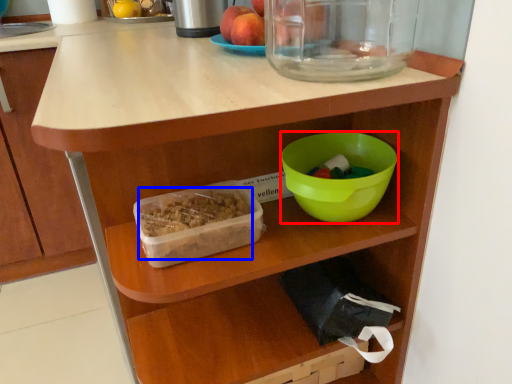
Question: Which object appears farthest to the camera in this image, bowl (highlighted by a red box) or food (highlighted by a blue box)?

Choices:
 (A) bowl
 (B) food

Answer: (A)